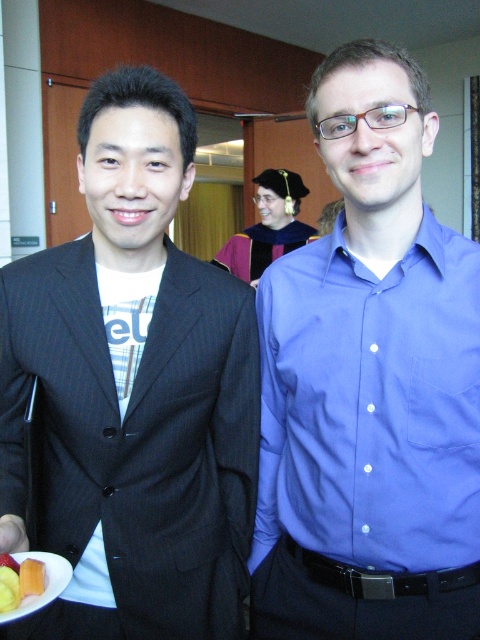
Question: Does blue smooth shirt at center have a larger size compared to dark pinstripe suit at left?

Choices:
 (A) yes
 (B) no

Answer: (B)

Question: Observing the image, what is the correct spatial positioning of blue smooth shirt at center in reference to maroon velvet graduation gown at center?

Choices:
 (A) left
 (B) right

Answer: (B)

Question: Among these objects, which one is nearest to the camera?

Choices:
 (A) yellow gelatinous at lower left
 (B) maroon velvet graduation gown at center
 (C) dark pinstripe suit at left
 (D) blue smooth shirt at center

Answer: (A)

Question: In this image, where is white checkered shirt at center located relative to yellow gelatinous at lower left?

Choices:
 (A) below
 (B) above

Answer: (B)

Question: Which point is closer to the camera?

Choices:
 (A) dark pinstripe suit at left
 (B) maroon velvet graduation gown at center

Answer: (A)

Question: Which object is the farthest from the dark pinstripe suit at left?

Choices:
 (A) blue smooth shirt at center
 (B) maroon velvet graduation gown at center
 (C) white checkered shirt at center
 (D) yellow gelatinous at lower left

Answer: (B)